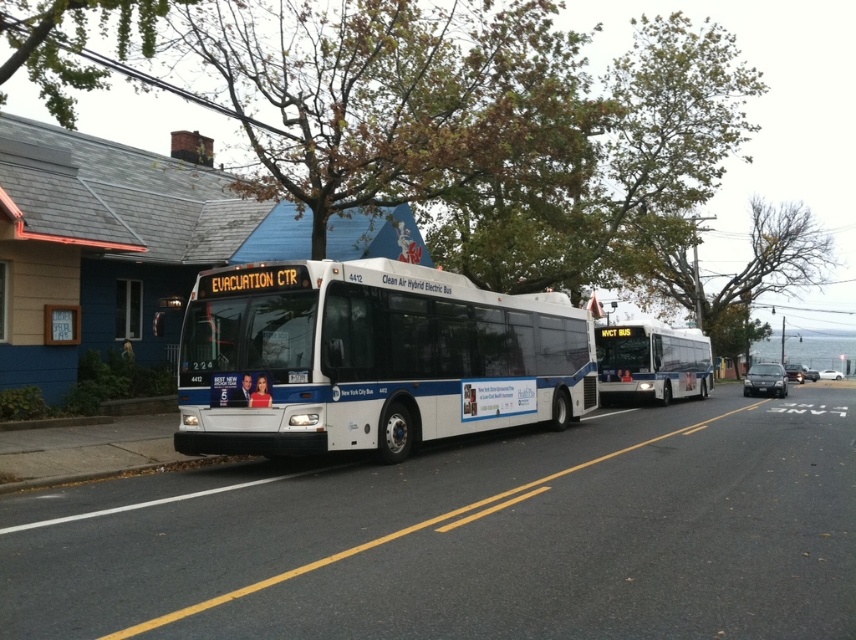
Is white glossy bus at center above white matte bus at center?

No.

Is white glossy bus at center smaller than white matte bus at center?

Yes, white glossy bus at center is smaller than white matte bus at center.

Which is in front, point (428, 419) or point (678, 346)?

Positioned in front is point (428, 419).

Where is `white glossy bus at center`? white glossy bus at center is located at coordinates (370, 358).

Is bare branches at upper center wider than white matte bus at center?

Correct, the width of bare branches at upper center exceeds that of white matte bus at center.

Does point (721, 307) come closer to viewer compared to point (704, 364)?

No, it is not.

In order to click on bare branches at upper center in this screenshot , I will do `click(722, 275)`.

Where is `bare branches at upper center`? This screenshot has width=856, height=640. bare branches at upper center is located at coordinates (722, 275).

Between point (43, 16) and point (685, 378), which one is positioned behind?

The point (685, 378) is more distant.

Between green leafy tree at upper center and white matte bus at center, which one is positioned higher?

green leafy tree at upper center

Who is more forward, (28, 35) or (623, 387)?

Point (28, 35) is more forward.

Where is `green leafy tree at upper center`? The image size is (856, 640). green leafy tree at upper center is located at coordinates (70, 44).